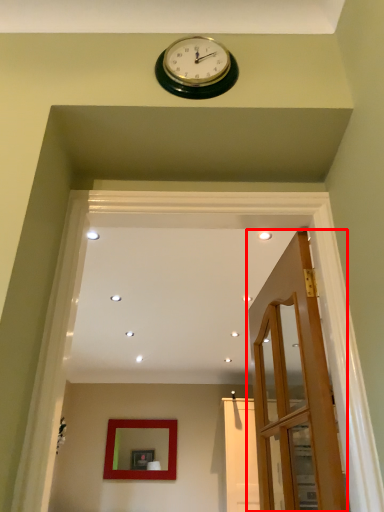
Question: Observing the image, what is the correct spatial positioning of door (annotated by the red box) in reference to mirror?

Choices:
 (A) left
 (B) right

Answer: (B)